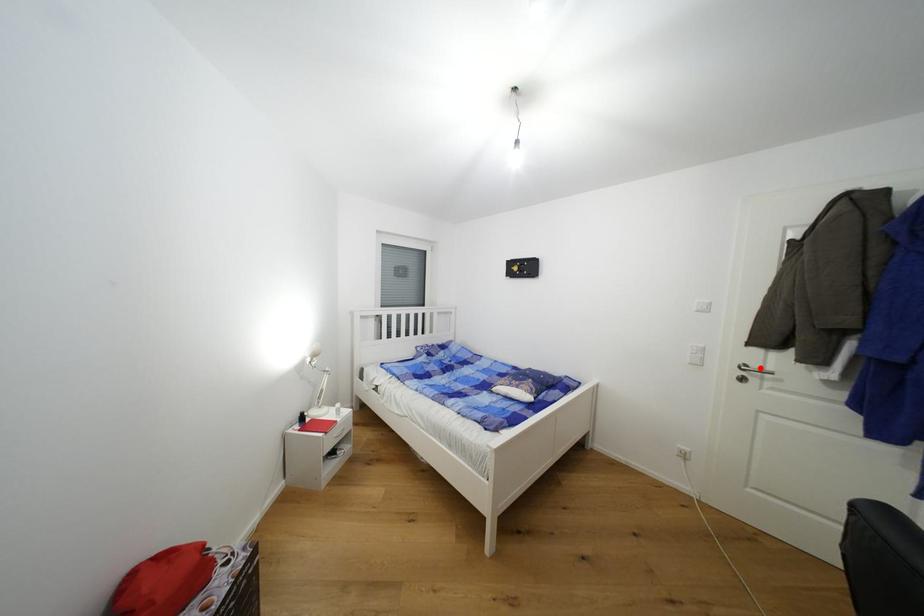
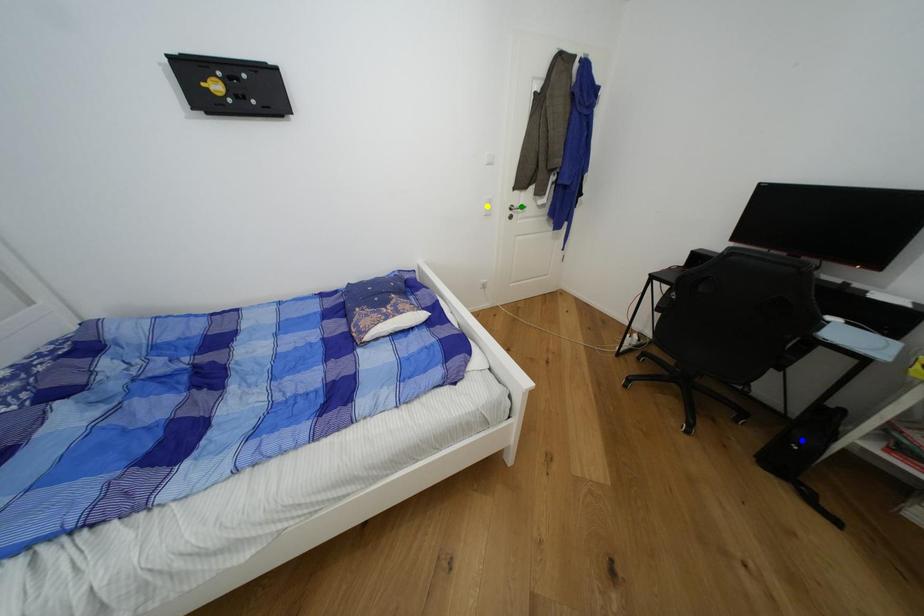
Question: I am providing you with two images of the same scene from different viewpoints. A red point is marked on the first image. You are given multiple points on the second image. Can you choose the point in image 2 that corresponds to the point in image 1?

Choices:
 (A) blue point
 (B) green point
 (C) yellow point

Answer: (B)